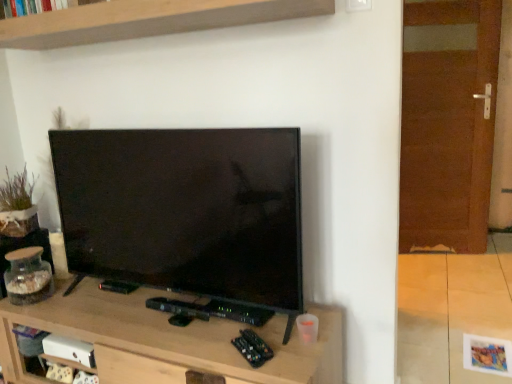
Question: Is wooden shelf at upper center oriented towards brown wooden door at right?

Choices:
 (A) no
 (B) yes

Answer: (A)

Question: From the image's perspective, is wooden shelf at upper center located beneath brown wooden door at right?

Choices:
 (A) no
 (B) yes

Answer: (A)

Question: Can you confirm if wooden shelf at upper center is thinner than brown wooden door at right?

Choices:
 (A) yes
 (B) no

Answer: (B)

Question: From the image's perspective, is wooden shelf at upper center over brown wooden door at right?

Choices:
 (A) yes
 (B) no

Answer: (A)

Question: Are wooden shelf at upper center and brown wooden door at right making contact?

Choices:
 (A) yes
 (B) no

Answer: (B)

Question: Is wooden shelf at upper center bigger than brown wooden door at right?

Choices:
 (A) yes
 (B) no

Answer: (B)

Question: Is wooden shelf at upper center behind clear glass jar at left?

Choices:
 (A) no
 (B) yes

Answer: (A)

Question: Is clear glass jar at left a part of wooden shelf at upper center?

Choices:
 (A) no
 (B) yes

Answer: (A)

Question: Would you consider wooden shelf at upper center to be distant from clear glass jar at left?

Choices:
 (A) yes
 (B) no

Answer: (A)

Question: Considering the relative sizes of wooden shelf at upper center and clear glass jar at left in the image provided, is wooden shelf at upper center taller than clear glass jar at left?

Choices:
 (A) no
 (B) yes

Answer: (B)

Question: Is wooden shelf at upper center smaller than clear glass jar at left?

Choices:
 (A) no
 (B) yes

Answer: (A)

Question: Can we say wooden shelf at upper center lies outside clear glass jar at left?

Choices:
 (A) yes
 (B) no

Answer: (A)

Question: Is brown wooden door at right aimed at clear glass jar at left?

Choices:
 (A) yes
 (B) no

Answer: (B)